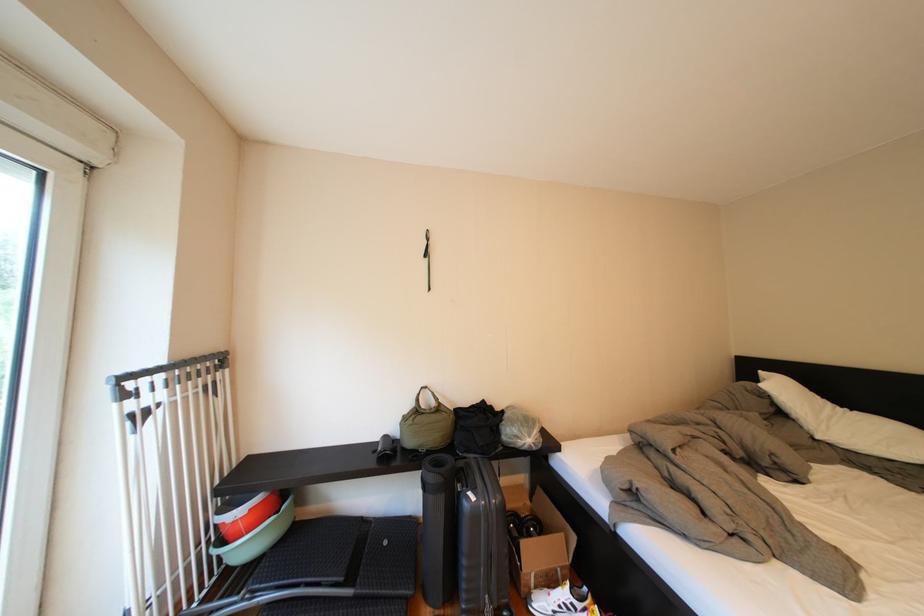
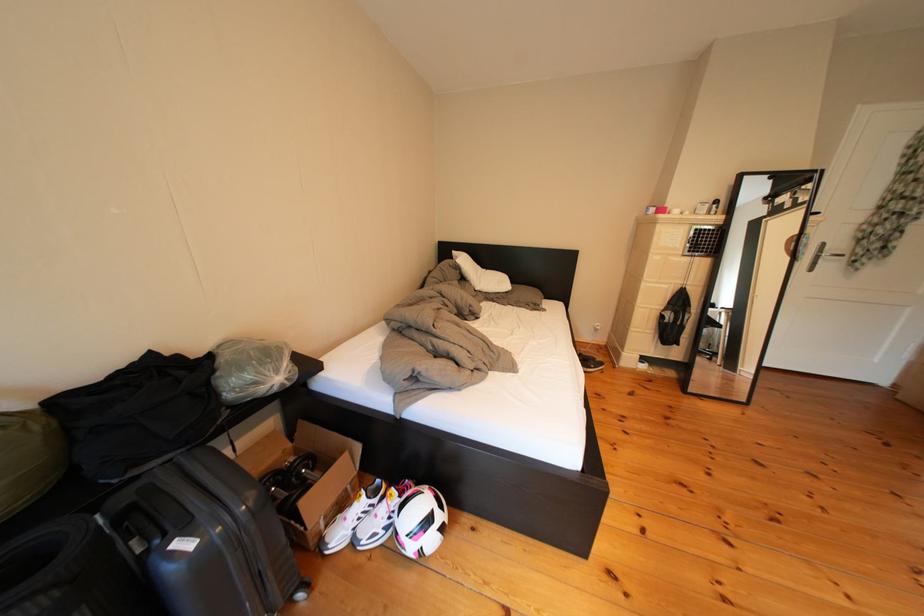
First-person continuous shooting, in which direction is the camera rotating?

The camera rotated toward right-down.